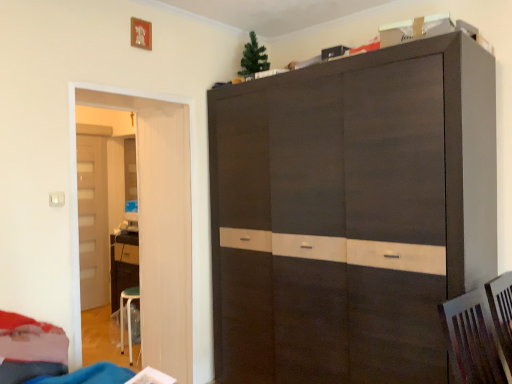
Question: Relative to light brown wood door at left, which is the second door from right to left, is white glossy door at left, positioned as the second door in back-to-front order, in front or behind?

Choices:
 (A) behind
 (B) front

Answer: (B)

Question: Is white glossy door at left, which is the 2th door in left-to-right order, wider or thinner than light brown wood door at left, the 2th door in the front-to-back sequence?

Choices:
 (A) wide
 (B) thin

Answer: (B)

Question: Which is farther from the white glossy door at left, which is the 2th door in left-to-right order?

Choices:
 (A) light brown wood door at left, the 2th door in the front-to-back sequence
 (B) velvet red bed at lower left

Answer: (A)

Question: Which object is the closest to the velvet red bed at lower left?

Choices:
 (A) white glossy door at left, which appears as the first door when viewed from the front
 (B) light brown wood door at left, positioned as the first door in left-to-right order

Answer: (A)